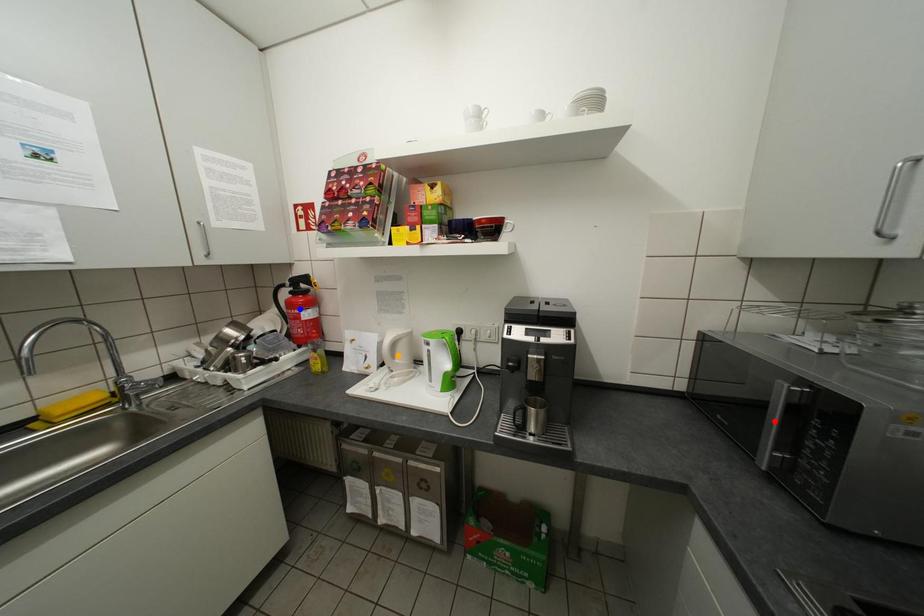
Order these from nearest to farthest:
A) blue point
B) red point
C) orange point

red point → orange point → blue point